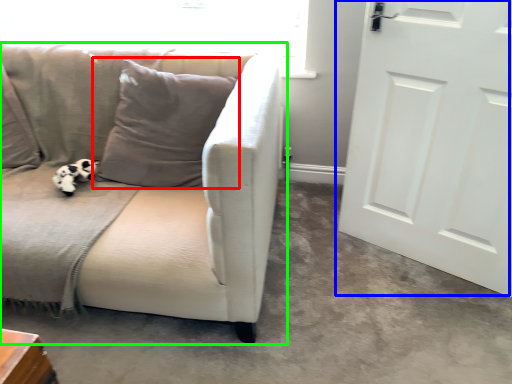
Question: Based on their relative distances, which object is farther from pillow (highlighted by a red box)? Choose from door (highlighted by a blue box) and studio couch (highlighted by a green box).

Choices:
 (A) door
 (B) studio couch

Answer: (A)